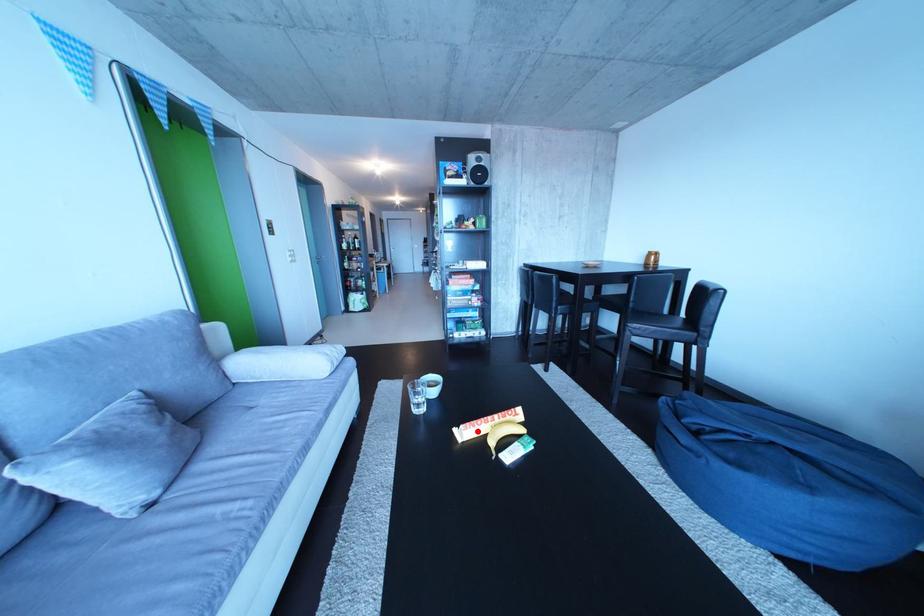
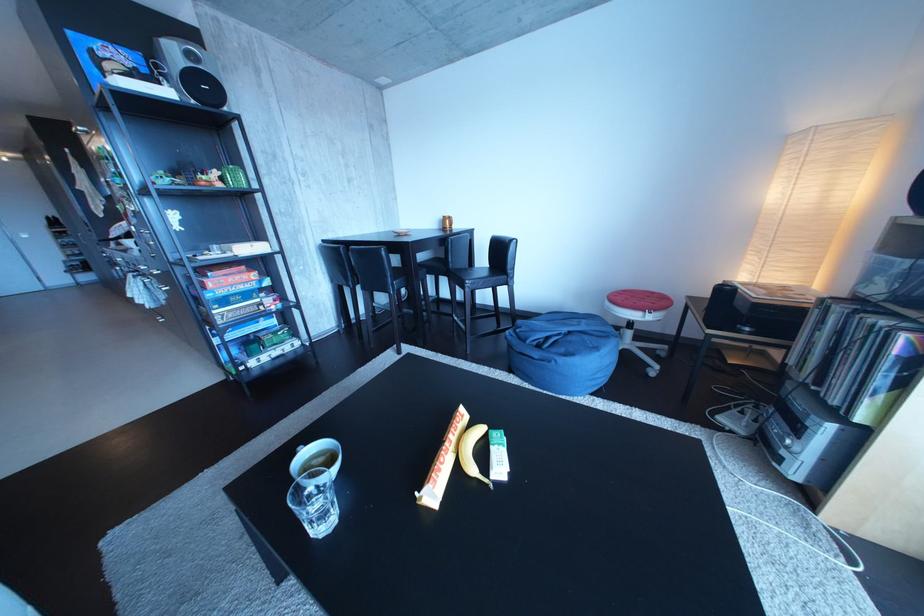
The point at the highlighted location is marked in the first image. Where is the corresponding point in the second image?

(444, 487)